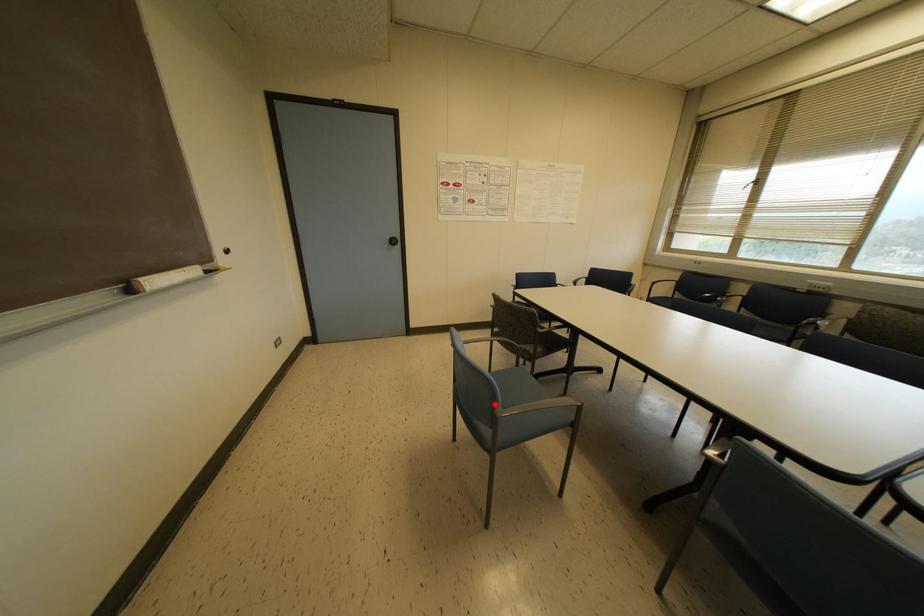
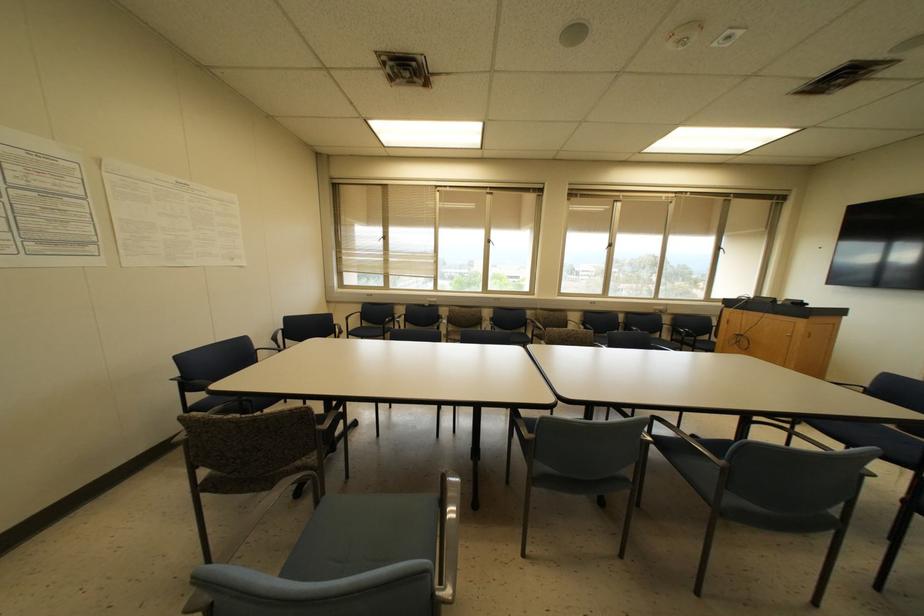
Find the pixel in the second image that matches the highlighted location in the first image.

(432, 594)